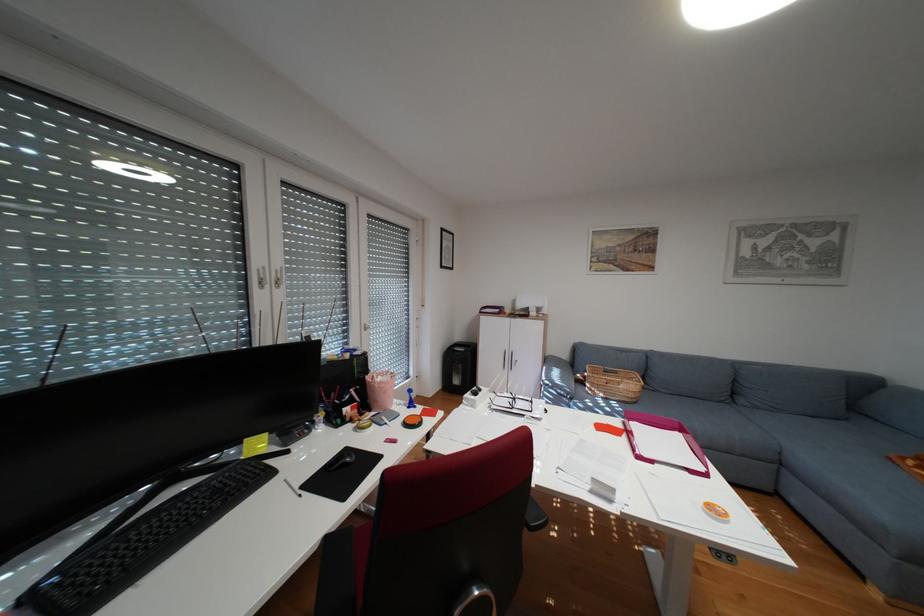
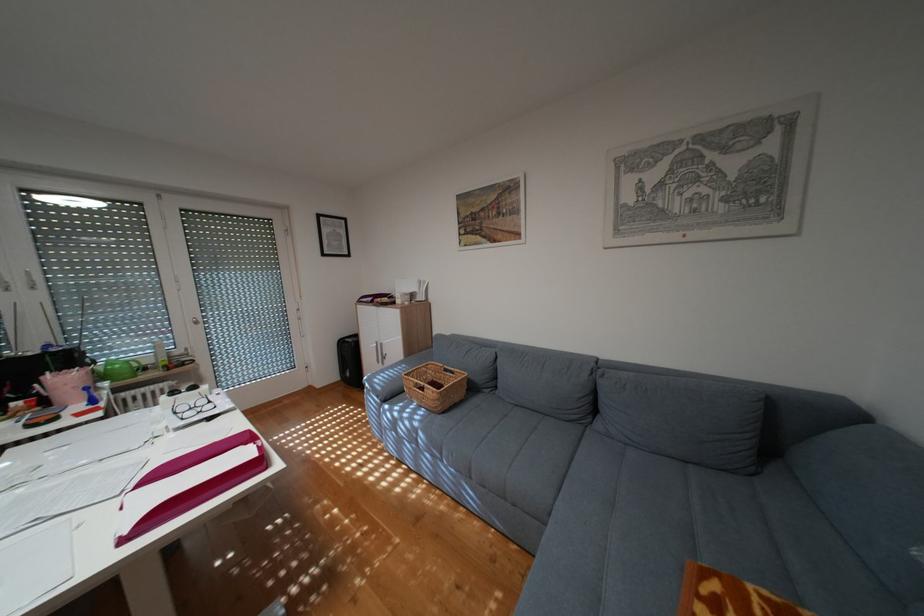
Question: In a continuous first-person perspective shot, in which direction is the camera moving?

Choices:
 (A) Left
 (B) Right
 (C) Forward
 (D) Backward

Answer: (B)